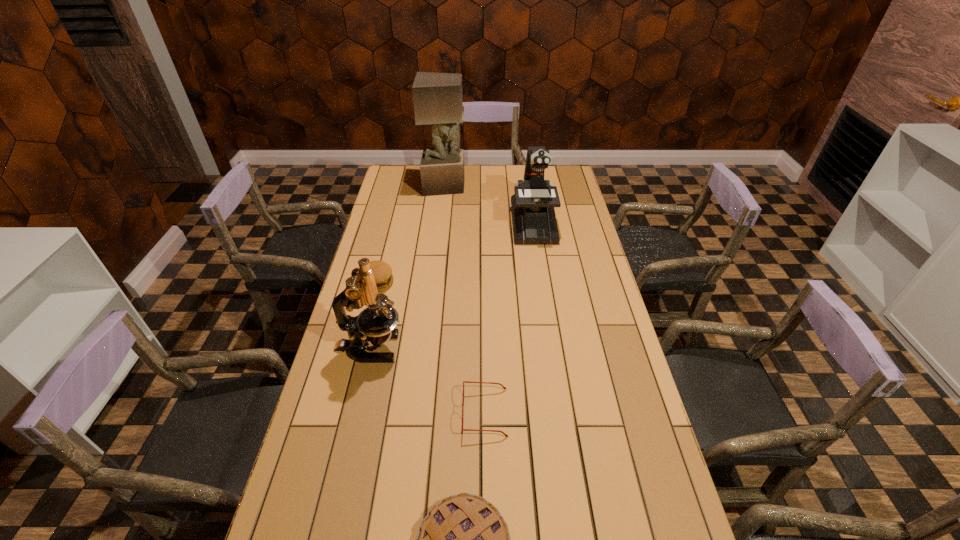
Identify the location of vacant space located on the front-facing side of the tallest object. Image resolution: width=960 pixels, height=540 pixels. (476, 186).

This screenshot has width=960, height=540. Identify the location of vacant area located 0.110m through the eyepieces of the second farthest object. (539, 262).

Identify the location of vacant space located 0.400m at the eyepiece of the left microscope. (531, 348).

In order to click on blank space located 0.390m on the back of the third farthest object in this screenshot , I will do `click(396, 214)`.

This screenshot has width=960, height=540. I want to click on blank space located on the face of the spectacles, so click(x=423, y=413).

Image resolution: width=960 pixels, height=540 pixels. In order to click on vacant space located on the face of the spectacles in this screenshot , I will do `click(413, 413)`.

Locate an element on the screen. The width and height of the screenshot is (960, 540). free spot located on the face of the spectacles is located at coordinates (372, 413).

The image size is (960, 540). In order to click on object that is at the far edge in this screenshot , I will do click(x=437, y=97).

Find the location of a particular element. microscope situated at the left edge is located at coordinates (378, 321).

I want to click on hamburger located in the left edge section of the desktop, so click(383, 276).